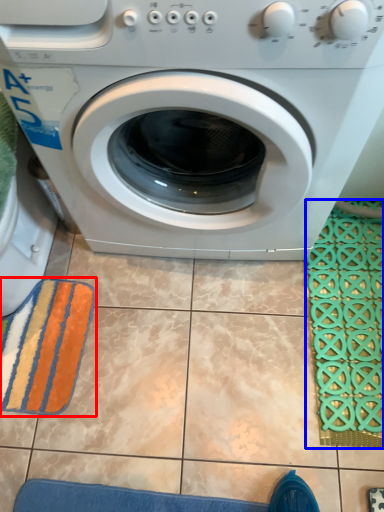
Question: Which object appears farthest to the camera in this image, bath towel (highlighted by a red box) or bath mat (highlighted by a blue box)?

Choices:
 (A) bath towel
 (B) bath mat

Answer: (A)